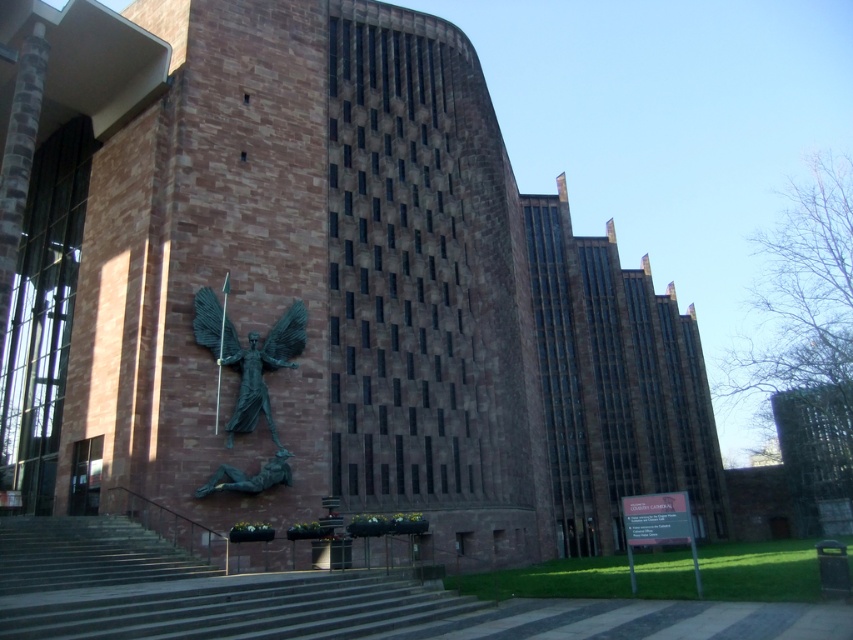
Which is in front, point (242, 420) or point (289, 484)?

Positioned in front is point (242, 420).

Based on the photo, which of these two, bronze statue at center or bronze/statue at lower center, stands taller?

bronze statue at center

Find the location of `bronze statue at center`. bronze statue at center is located at coordinates (248, 381).